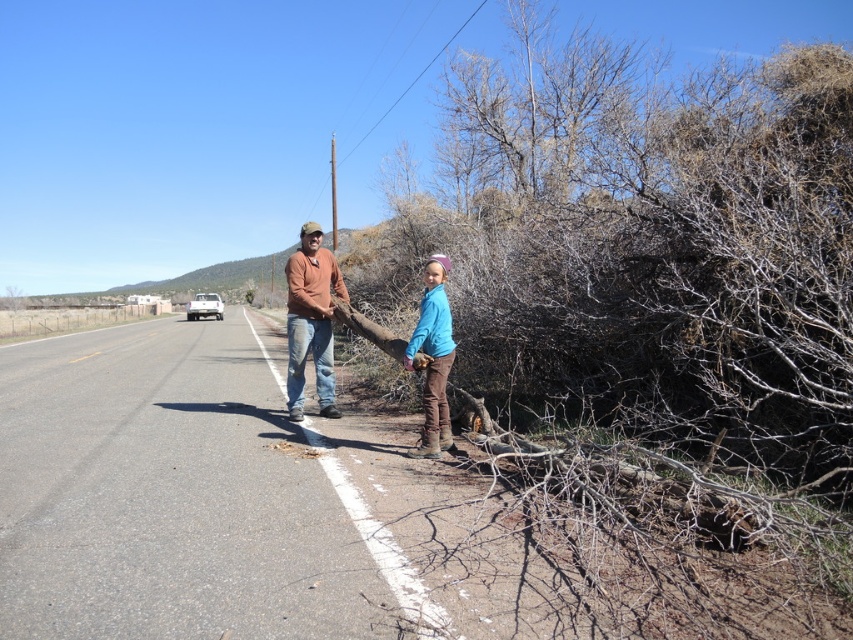
Question: Does asphalt road at center have a larger size compared to blue fleece jacket at center?

Choices:
 (A) yes
 (B) no

Answer: (A)

Question: Where is asphalt road at center located in relation to matte orange shirt at center in the image?

Choices:
 (A) left
 (B) right

Answer: (A)

Question: Estimate the real-world distances between objects in this image. Which object is closer to the matte brown shirt at center?

Choices:
 (A) asphalt road at center
 (B) blue fleece jacket at center
 (C) matte orange shirt at center

Answer: (B)

Question: Which point is farther from the camera taking this photo?

Choices:
 (A) (445, 420)
 (B) (300, 253)

Answer: (B)

Question: Is brown dry wood at right smaller than matte brown shirt at center?

Choices:
 (A) no
 (B) yes

Answer: (A)

Question: Among these objects, which one is farthest from the camera?

Choices:
 (A) blue fleece jacket at center
 (B) brown dry wood at right
 (C) matte brown shirt at center
 (D) asphalt road at center

Answer: (C)